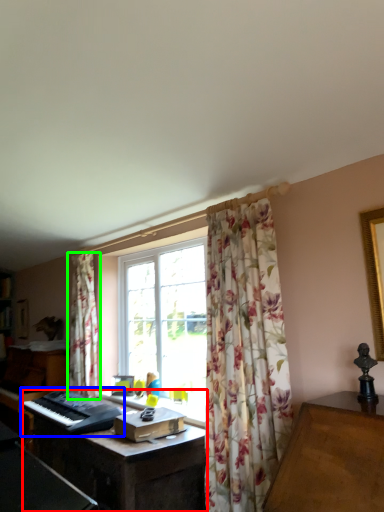
Question: Which is farther away from computer desk (highlighted by a red box)? musical keyboard (highlighted by a blue box) or curtain (highlighted by a green box)?

Choices:
 (A) musical keyboard
 (B) curtain

Answer: (B)